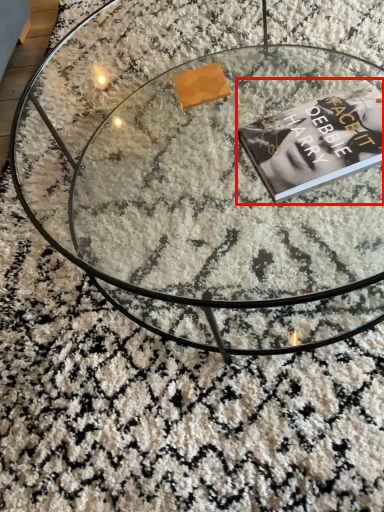
Question: Considering the relative positions of paperback book (annotated by the red box) and coffee table in the image provided, where is paperback book (annotated by the red box) located with respect to the staircase?

Choices:
 (A) right
 (B) left

Answer: (A)